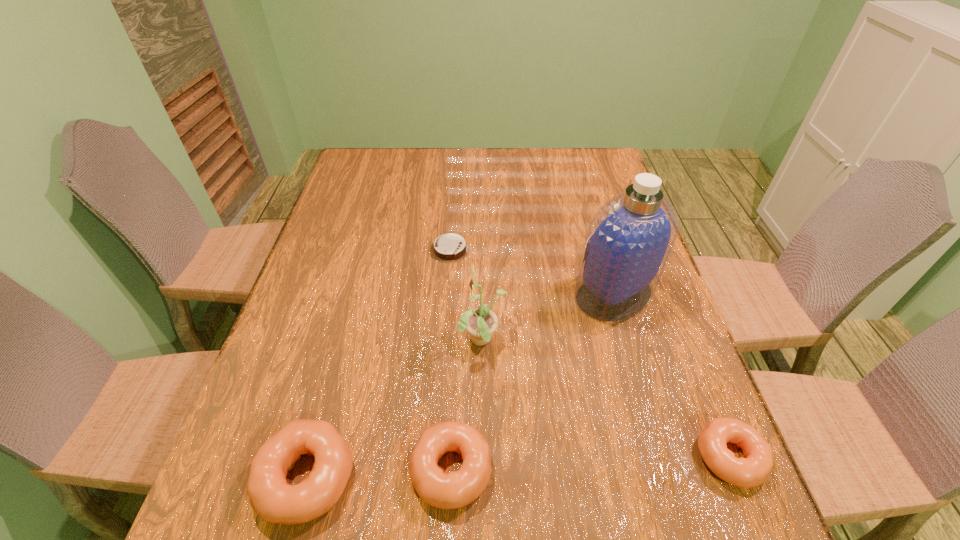
Locate which doughnut ranks in proximity to the second doughnut from left to right. Please provide its 2D coordinates. Your answer should be formatted as a tuple, i.e. [(x, y)], where the tuple contains the x and y coordinates of a point satisfying the conditions above.

[(271, 497)]

I want to click on free space that satisfies the following two spatial constraints: 1. on the front side of the second shortest doughnut; 2. on the right side of the farthest object, so click(434, 470).

I want to click on vacant space that satisfies the following two spatial constraints: 1. on the back side of the chocolate cake; 2. on the left side of the leftmost doughnut, so (368, 250).

At what (x,y) coordinates should I click in order to perform the action: click on vacant point that satisfies the following two spatial constraints: 1. on the back side of the rightmost doughnut; 2. on the left side of the second shortest doughnut. Please return your answer as a coordinate pair (x, y). Image resolution: width=960 pixels, height=540 pixels. Looking at the image, I should click on (451, 457).

Image resolution: width=960 pixels, height=540 pixels. Identify the location of vacant space that satisfies the following two spatial constraints: 1. on the back side of the fourth tallest object; 2. on the right side of the rightmost doughnut. (451, 457).

Where is `blank space that satisfies the following two spatial constraints: 1. on the front side of the tallest object; 2. on the left side of the fifth tallest object`? blank space that satisfies the following two spatial constraints: 1. on the front side of the tallest object; 2. on the left side of the fifth tallest object is located at coordinates (661, 457).

Identify the location of free location that satisfies the following two spatial constraints: 1. on the front-facing side of the sunflower; 2. on the left side of the rightmost doughnut. (484, 457).